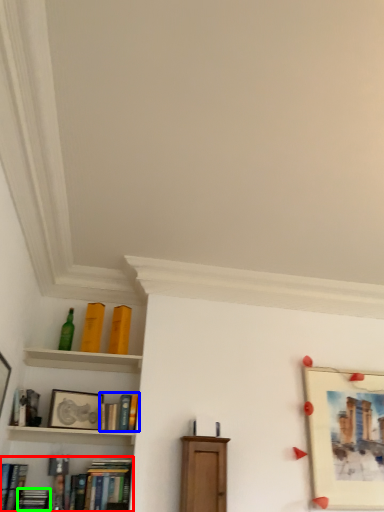
Question: Based on their relative distances, which object is farther from book (highlighted by a red box)? Choose from book (highlighted by a blue box) and book (highlighted by a green box).

Choices:
 (A) book
 (B) book

Answer: (A)